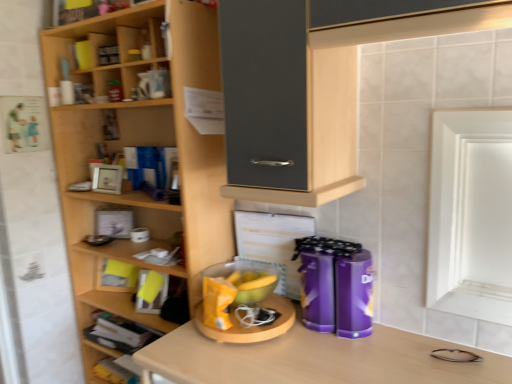
Image resolution: width=512 pixels, height=384 pixels. Identify the location of blank space situated above yellow matte bowl at center, the 1th appliance in the left-to-right sequence (from a real-world perspective). (239, 276).